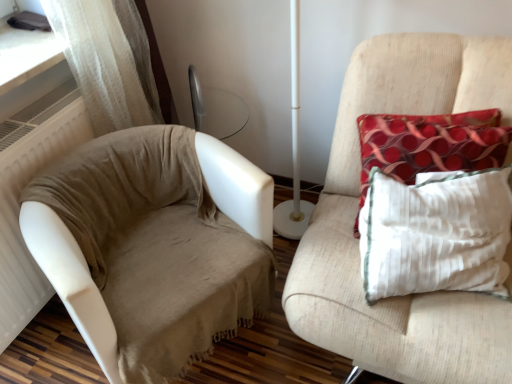
Question: Is textured beige armchair at right next to beige fabric couch at left and touching it?

Choices:
 (A) yes
 (B) no

Answer: (B)

Question: Is textured beige armchair at right at the right side of beige fabric couch at left?

Choices:
 (A) yes
 (B) no

Answer: (A)

Question: From the image's perspective, is textured beige armchair at right located beneath beige fabric couch at left?

Choices:
 (A) no
 (B) yes

Answer: (A)

Question: Considering the relative sizes of textured beige armchair at right and beige fabric couch at left in the image provided, is textured beige armchair at right taller than beige fabric couch at left?

Choices:
 (A) no
 (B) yes

Answer: (B)

Question: Considering the relative positions of textured beige armchair at right and beige fabric couch at left in the image provided, is textured beige armchair at right to the left of beige fabric couch at left from the viewer's perspective?

Choices:
 (A) yes
 (B) no

Answer: (B)

Question: Could beige fabric couch at left be considered to be inside textured beige armchair at right?

Choices:
 (A) yes
 (B) no

Answer: (B)

Question: Is red dotted fabric pillow at right oriented towards beige fabric couch at left?

Choices:
 (A) no
 (B) yes

Answer: (A)

Question: Would you say red dotted fabric pillow at right contains beige fabric couch at left?

Choices:
 (A) yes
 (B) no

Answer: (B)

Question: Can you confirm if red dotted fabric pillow at right is positioned to the left of beige fabric couch at left?

Choices:
 (A) no
 (B) yes

Answer: (A)

Question: Is red dotted fabric pillow at right facing away from beige fabric couch at left?

Choices:
 (A) no
 (B) yes

Answer: (A)

Question: Considering the relative sizes of red dotted fabric pillow at right and beige fabric couch at left in the image provided, is red dotted fabric pillow at right wider than beige fabric couch at left?

Choices:
 (A) no
 (B) yes

Answer: (A)

Question: Considering the relative sizes of red dotted fabric pillow at right and beige fabric couch at left in the image provided, is red dotted fabric pillow at right taller than beige fabric couch at left?

Choices:
 (A) yes
 (B) no

Answer: (B)

Question: Is the surface of beige fabric couch at left in direct contact with red dotted fabric pillow at right?

Choices:
 (A) yes
 (B) no

Answer: (B)